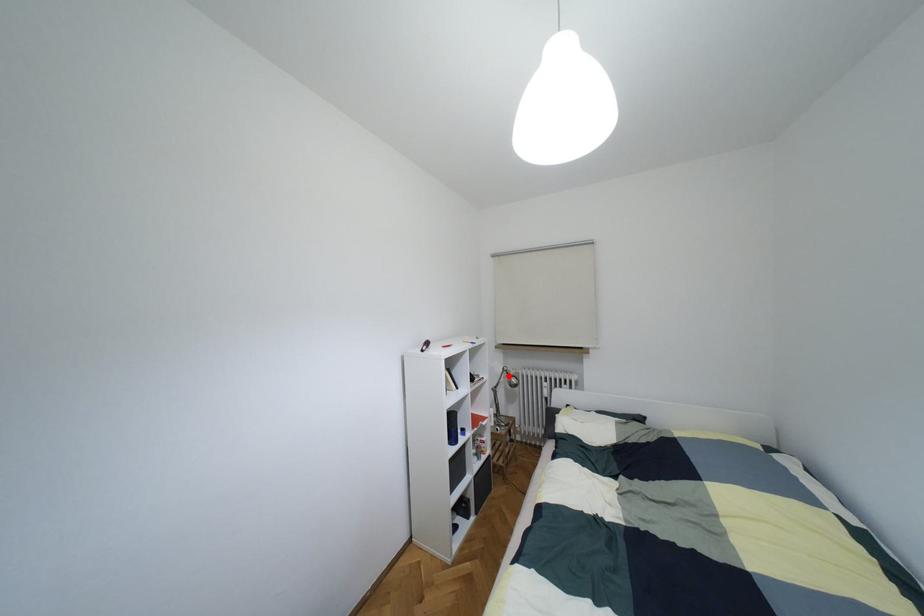
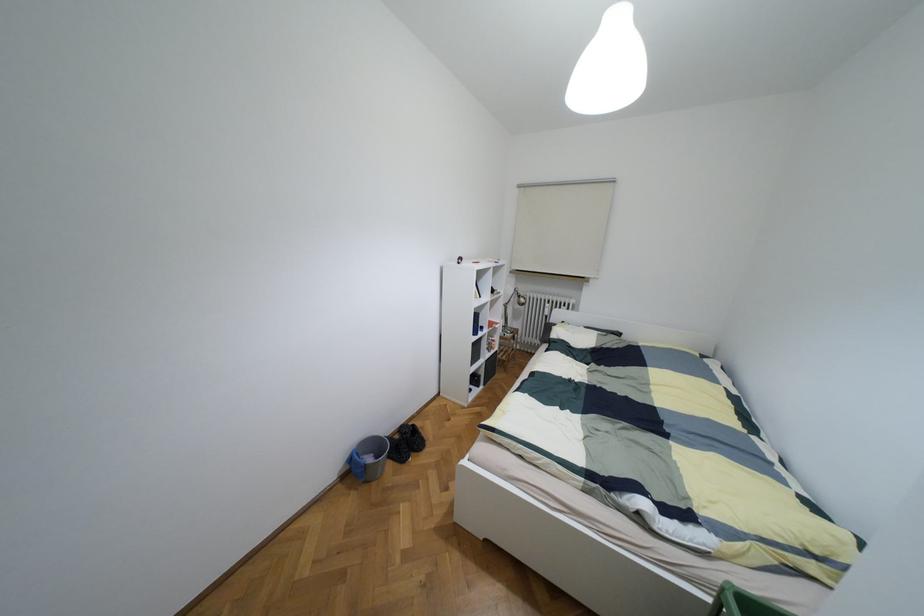
Question: I am providing you with two images of the same scene from different viewpoints. A red point is shown in image1. For the corresponding object point in image2, is it positioned nearer or farther from the camera?

Choices:
 (A) Nearer
 (B) Farther

Answer: (A)